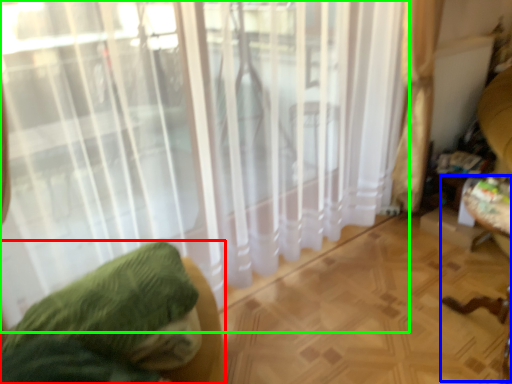
Question: Which is nearer to the furniture (highlighted by a red box)? swivel chair (highlighted by a blue box) or curtain (highlighted by a green box).

Choices:
 (A) swivel chair
 (B) curtain

Answer: (B)